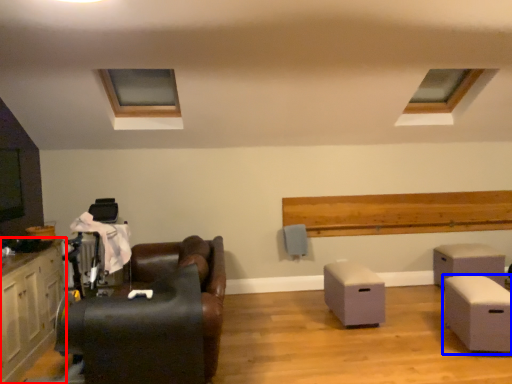
Question: Which object appears closest to the camera in this image, cabinetry (highlighted by a red box) or table (highlighted by a blue box)?

Choices:
 (A) cabinetry
 (B) table

Answer: (A)